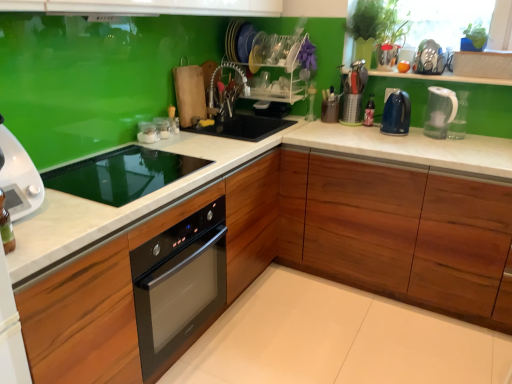
Question: Is metallic silver utensil holder at upper right, marked as the 5th appliance in a left-to-right arrangement, shorter than metallic silver toaster at upper right, the 1th appliance from the right?

Choices:
 (A) yes
 (B) no

Answer: (B)

Question: From the image's perspective, is metallic silver utensil holder at upper right, marked as the 5th appliance in a left-to-right arrangement, on metallic silver toaster at upper right, the 1th appliance from the right?

Choices:
 (A) no
 (B) yes

Answer: (A)

Question: Can you confirm if metallic silver utensil holder at upper right, marked as the 5th appliance in a left-to-right arrangement, is bigger than metallic silver toaster at upper right, the 1th appliance from the right?

Choices:
 (A) no
 (B) yes

Answer: (A)

Question: Can you confirm if metallic silver utensil holder at upper right, which ranks as the 2th appliance in right-to-left order, is wider than metallic silver toaster at upper right, the 1th appliance from the right?

Choices:
 (A) no
 (B) yes

Answer: (A)

Question: Does metallic silver utensil holder at upper right, marked as the 5th appliance in a left-to-right arrangement, appear on the left side of metallic silver toaster at upper right, which is counted as the sixth appliance, starting from the left?

Choices:
 (A) no
 (B) yes

Answer: (B)

Question: Does metallic silver utensil holder at upper right, which ranks as the 2th appliance in right-to-left order, lie in front of metallic silver toaster at upper right, which is counted as the sixth appliance, starting from the left?

Choices:
 (A) yes
 (B) no

Answer: (B)

Question: Does clear plastic dish rack at center, the second shelf in the bottom-to-top sequence, have a larger size compared to white glossy microwave at left?

Choices:
 (A) no
 (B) yes

Answer: (B)

Question: From the image's perspective, is clear plastic dish rack at center, the second shelf in the bottom-to-top sequence, located above white glossy microwave at left?

Choices:
 (A) no
 (B) yes

Answer: (B)

Question: Can you confirm if clear plastic dish rack at center, the second shelf in the bottom-to-top sequence, is taller than white glossy microwave at left?

Choices:
 (A) no
 (B) yes

Answer: (B)

Question: Is clear plastic dish rack at center, which ranks as the 1th shelf in top-to-bottom order, positioned behind white glossy microwave at left?

Choices:
 (A) yes
 (B) no

Answer: (A)

Question: Is clear plastic dish rack at center, which ranks as the 1th shelf in top-to-bottom order, directly adjacent to white glossy microwave at left?

Choices:
 (A) yes
 (B) no

Answer: (B)

Question: Is clear glass jars at center, which is counted as the 3th appliance, starting from the left, aimed at white glossy microwave at left?

Choices:
 (A) yes
 (B) no

Answer: (B)